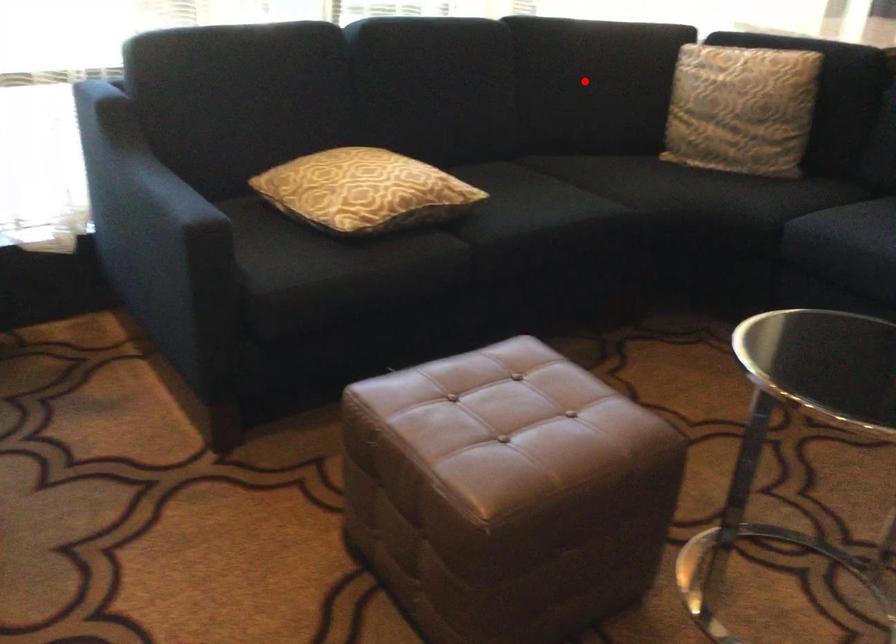
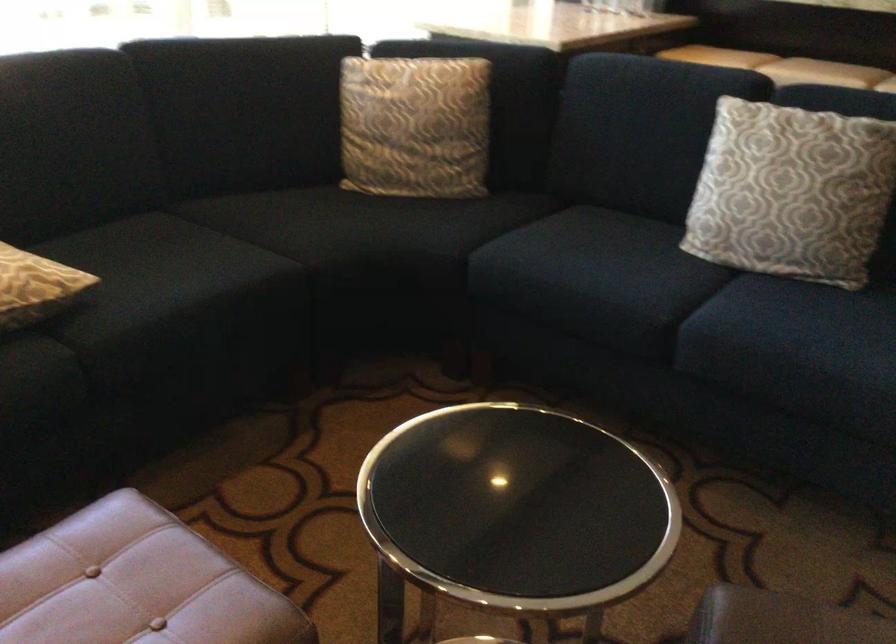
Question: I am providing you with two images of the same scene from different viewpoints. Given a red point in image1, look at the same physical point in image2. Is it:

Choices:
 (A) Closer to the viewpoint
 (B) Farther from the viewpoint

Answer: (A)